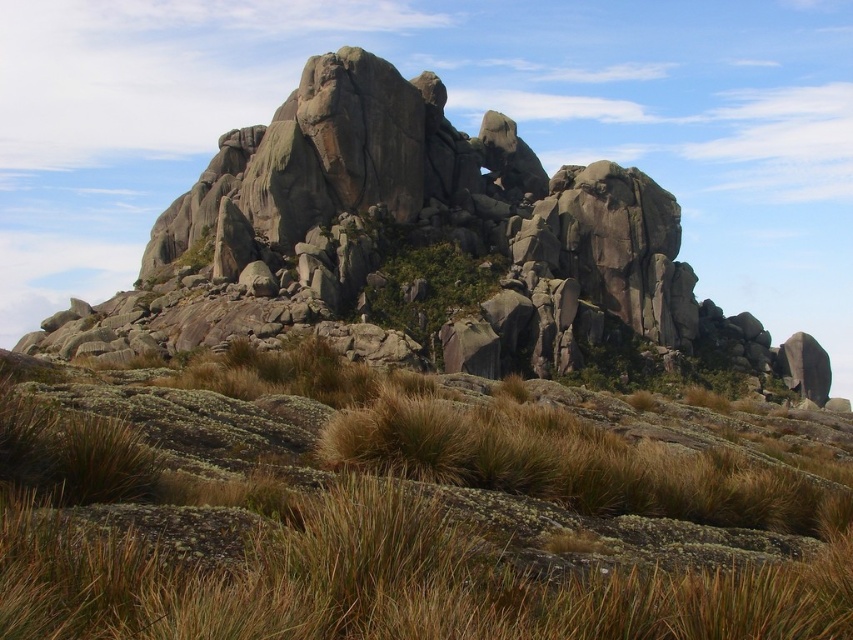
Question: Does gray rough rock formation at center appear on the left side of green leafy shrub at center?

Choices:
 (A) no
 (B) yes

Answer: (A)

Question: Which point is closer to the camera?

Choices:
 (A) gray rough rock formation at center
 (B) green leafy shrub at center
 (C) brown grassy at center

Answer: (C)

Question: Can you confirm if gray rough rock formation at center is positioned to the right of green leafy shrub at center?

Choices:
 (A) no
 (B) yes

Answer: (B)

Question: Which point is closer to the camera?

Choices:
 (A) brown grassy at center
 (B) green leafy shrub at center

Answer: (A)

Question: Which point is closer to the camera taking this photo?

Choices:
 (A) (682, 616)
 (B) (476, 266)

Answer: (A)

Question: Does brown grassy at center come in front of green leafy shrub at center?

Choices:
 (A) no
 (B) yes

Answer: (B)